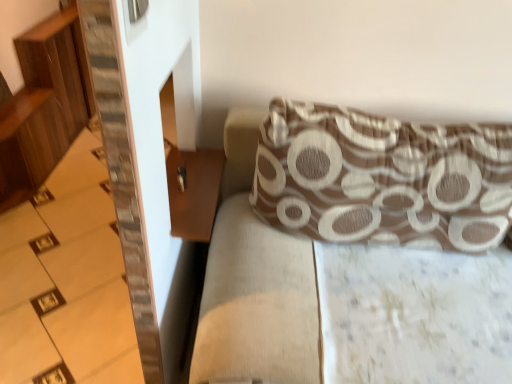
Describe the element at coordinates (359, 245) in the screenshot. I see `brown textured cushion at upper right` at that location.

Identify the location of brown textured pillow at upper right. The height and width of the screenshot is (384, 512). (383, 178).

In order to face wooden stairs at left, should I rotate leftwards or rightwards?

Turn left by 18.958 degrees to look at wooden stairs at left.

This screenshot has width=512, height=384. Find the location of `brown textured cushion at upper right`. brown textured cushion at upper right is located at coordinates (359, 245).

Are brown wooden table at lower left and brown textured pillow at upper right making contact?

brown wooden table at lower left and brown textured pillow at upper right are clearly separated.

Which is closer, [209,231] or [378,200]?

Point [209,231].

From the image's perspective, which one is positioned higher, brown wooden table at lower left or brown textured pillow at upper right?

brown textured pillow at upper right.

Considering the relative sizes of brown wooden table at lower left and brown textured pillow at upper right in the image provided, is brown wooden table at lower left shorter than brown textured pillow at upper right?

Yes, brown wooden table at lower left is shorter than brown textured pillow at upper right.

Is brown textured pillow at upper right in front of or behind brown textured cushion at upper right in the image?

Clearly, brown textured pillow at upper right is behind brown textured cushion at upper right.

Looking at this image, how different are the orientations of brown textured pillow at upper right and brown textured cushion at upper right in degrees?

6.02e-05 degrees separate the facing orientations of brown textured pillow at upper right and brown textured cushion at upper right.

Find the location of a particular element. couch below the brown textured pillow at upper right (from the image's perspective) is located at coordinates (359, 245).

Image resolution: width=512 pixels, height=384 pixels. What are the coordinates of `couch on the right of wooden stairs at left` in the screenshot? It's located at (359, 245).

Based on the photo, are brown textured cushion at upper right and wooden stairs at left located far from each other?

That's not correct — brown textured cushion at upper right is a little close to wooden stairs at left.

Which point is more distant from viewer, (407, 181) or (94, 318)?

Point (94, 318)

From a real-world perspective, is brown textured cushion at upper right above or below wooden stairs at left?

brown textured cushion at upper right is situated higher than wooden stairs at left in the real world.

Looking at this image, between brown textured pillow at upper right and wooden stairs at left, which one appears on the left side from the viewer's perspective?

wooden stairs at left is more to the left.

Considering the positions of point (466, 186) and point (73, 238), is point (466, 186) closer or farther from the camera than point (73, 238)?

Point (466, 186) is positioned closer to the camera compared to point (73, 238).

Is the depth of brown textured pillow at upper right greater than that of wooden stairs at left?

No, it is not.

Is brown textured pillow at upper right at the back of wooden stairs at left?

No, wooden stairs at left is not facing away from brown textured pillow at upper right.

How distant is wooden stairs at left from brown textured pillow at upper right?

wooden stairs at left is 1.06 meters from brown textured pillow at upper right.

Based on the photo, is wooden stairs at left positioned far away from brown textured pillow at upper right?

Yes, wooden stairs at left and brown textured pillow at upper right are quite far apart.

Which is correct: wooden stairs at left is inside brown textured pillow at upper right, or outside of it?

wooden stairs at left is spatially situated outside brown textured pillow at upper right.

Is point (18, 254) farther from camera compared to point (238, 275)?

Yes, it is behind point (238, 275).

Is wooden stairs at left wider or thinner than brown textured cushion at upper right?

In the image, wooden stairs at left appears to be wider than brown textured cushion at upper right.

Identify the location of stairwell located underneath the brown textured cushion at upper right (from a real-world perspective). (66, 280).

Is wooden stairs at left positioned before brown textured cushion at upper right?

No, wooden stairs at left is further to the viewer.

Which of these two, brown wooden table at lower left or brown textured cushion at upper right, is thinner?

brown wooden table at lower left is thinner.

Is the position of brown wooden table at lower left less distant than that of brown textured cushion at upper right?

No.

From a real-world perspective, is brown wooden table at lower left below brown textured cushion at upper right?

Actually, brown wooden table at lower left is physically above brown textured cushion at upper right in the real world.

Where is `pillow on the right of brown wooden table at lower left`? This screenshot has width=512, height=384. pillow on the right of brown wooden table at lower left is located at coordinates (383, 178).

Where is `couch below the brown textured pillow at upper right (from the image's perspective)`? This screenshot has width=512, height=384. couch below the brown textured pillow at upper right (from the image's perspective) is located at coordinates pyautogui.click(x=359, y=245).

Which object lies further to the anchor point brown textured pillow at upper right, brown wooden table at lower left or brown textured cushion at upper right?

brown wooden table at lower left is positioned further to the anchor brown textured pillow at upper right.

Looking at the image, which one is located closer to brown textured pillow at upper right, wooden stairs at left or brown wooden table at lower left?

The object closer to brown textured pillow at upper right is brown wooden table at lower left.

When comparing their distances from brown wooden table at lower left, does wooden stairs at left or brown textured pillow at upper right seem further?

wooden stairs at left.

From the image, which object appears to be nearer to brown wooden table at lower left, brown textured pillow at upper right or wooden stairs at left?

brown textured pillow at upper right.

Looking at the image, which one is located further to brown textured cushion at upper right, brown textured pillow at upper right or brown wooden table at lower left?

brown wooden table at lower left is positioned further to the anchor brown textured cushion at upper right.

Estimate the real-world distances between objects in this image. Which object is closer to brown wooden table at lower left, brown textured cushion at upper right or wooden stairs at left?

The object closer to brown wooden table at lower left is brown textured cushion at upper right.

Based on the photo, based on their spatial positions, is brown textured cushion at upper right or brown wooden table at lower left further from brown textured pillow at upper right?

Based on the image, brown wooden table at lower left appears to be further to brown textured pillow at upper right.

Based on the photo, looking at the image, which one is located closer to wooden stairs at left, brown textured cushion at upper right or brown textured pillow at upper right?

brown textured cushion at upper right is closer to wooden stairs at left.

The height and width of the screenshot is (384, 512). In order to click on table between wooden stairs at left and brown textured pillow at upper right from left to right in this screenshot , I will do `click(194, 191)`.

This screenshot has height=384, width=512. I want to click on pillow between brown wooden table at lower left and brown textured cushion at upper right from left to right, so click(x=383, y=178).

Where is `table between wooden stairs at left and brown textured cushion at upper right`? This screenshot has width=512, height=384. table between wooden stairs at left and brown textured cushion at upper right is located at coordinates (194, 191).

Where is `pillow between wooden stairs at left and brown textured cushion at upper right`? The height and width of the screenshot is (384, 512). pillow between wooden stairs at left and brown textured cushion at upper right is located at coordinates (383, 178).